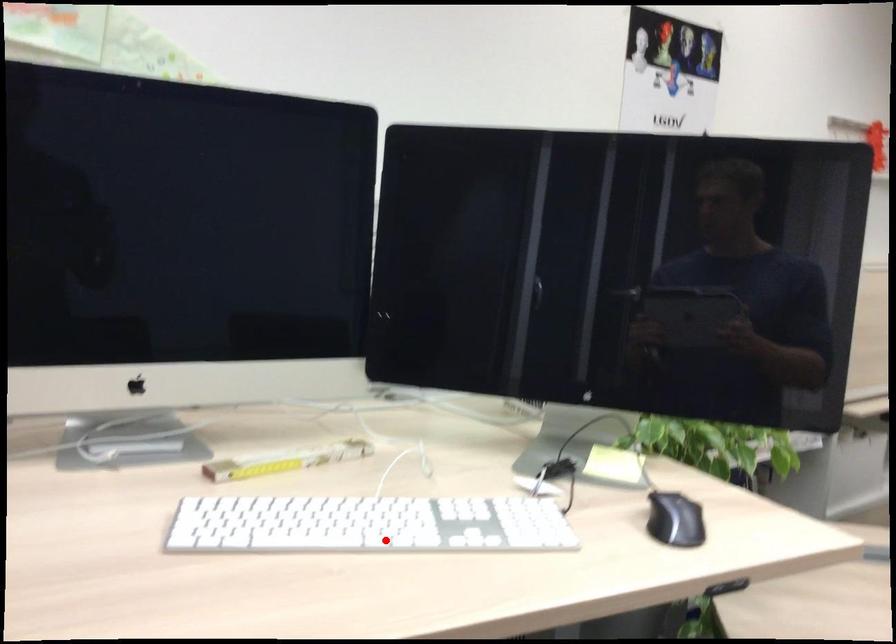
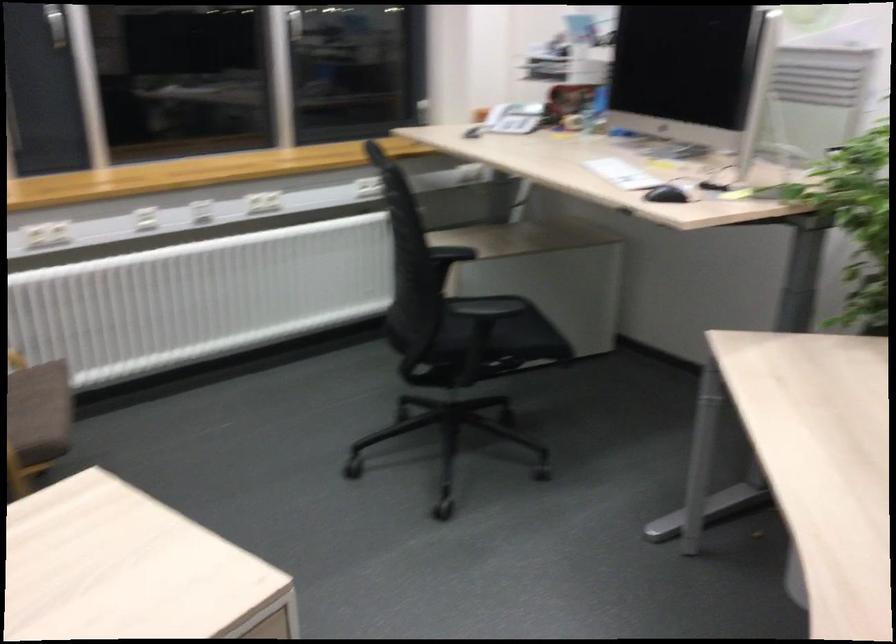
Where in the second image is the point corresponding to the highlighted location from the first image?

(622, 174)